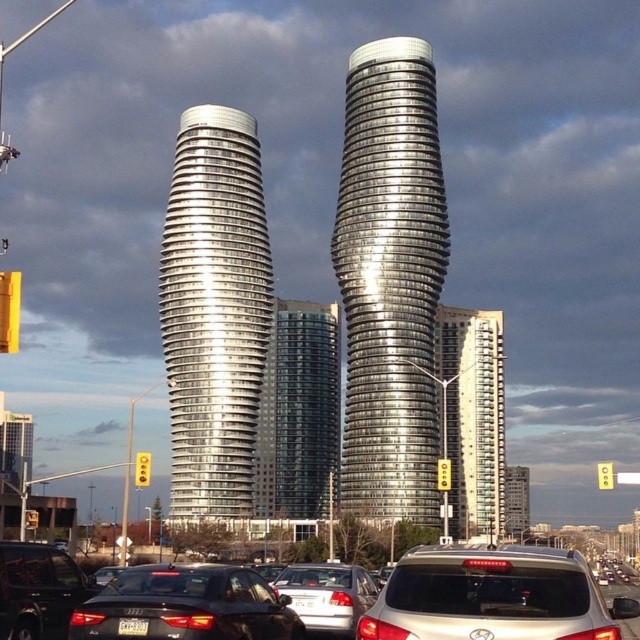
You are a drone operator trying to deliver a package to the silver glass building at center. The delivery zone is marked by a point at coordinates (x=474, y=417). Can you confirm if this point is indeed located on the silver glass building at center?

Yes, the point at coordinates (x=474, y=417) is located on the silver glass building at center as described.

You are a drone operator tasked with flying a drone between the two skyscrapers in the scene. The drone has a height limit of 10 meters. Given the positions of the silver glass building at center and the metallic glass building at center, can you safely navigate the drone between them without exceeding the height limit?

The silver glass building at center is located above the metallic glass building at center, so the vertical distance between them is likely greater than 10 meters. Therefore, the drone can safely navigate between them without exceeding its height limit of 10 meters.

You are a delivery driver in a silver metallic suv at center. You need to park your vehicle under a shaded area provided by the silver glass building at center. Is your suv short enough to fit under the building without hitting the roof?

The silver metallic suv at center is shorter than the silver glass building at center, so yes, the suv can fit under the building without any issues.